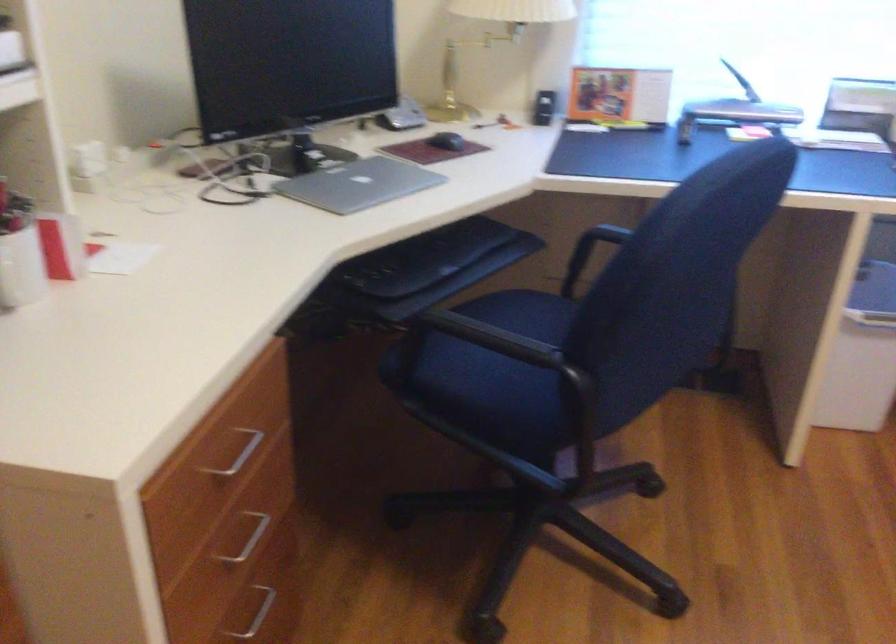
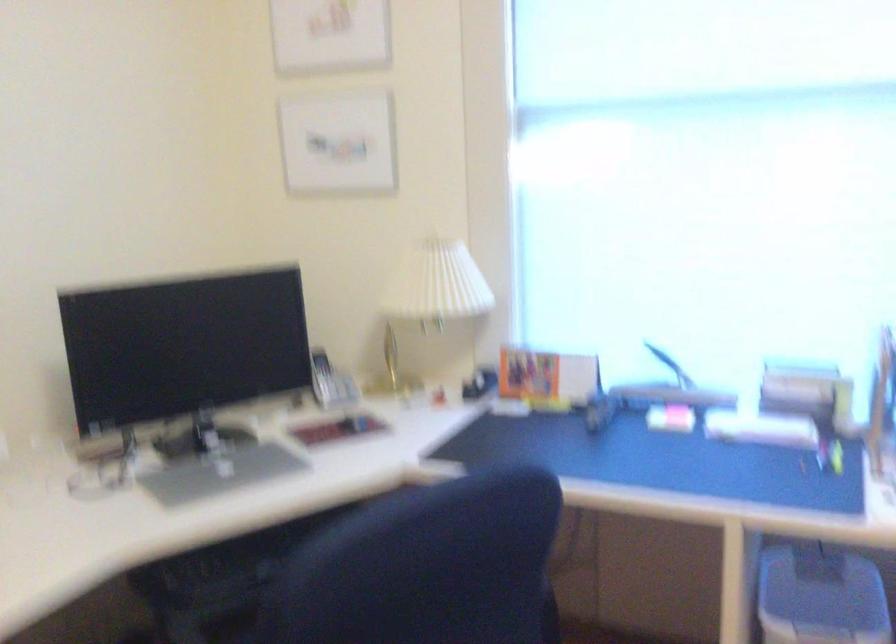
Question: The first image is from the beginning of the video and the second image is from the end. How did the camera likely rotate when shooting the video?

Choices:
 (A) Left
 (B) Right
 (C) Up
 (D) Down

Answer: (C)